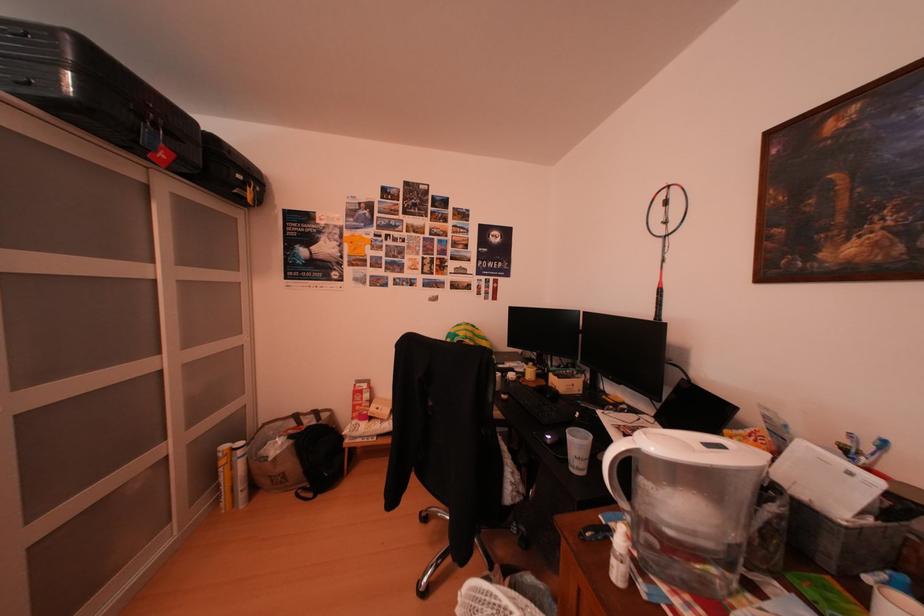
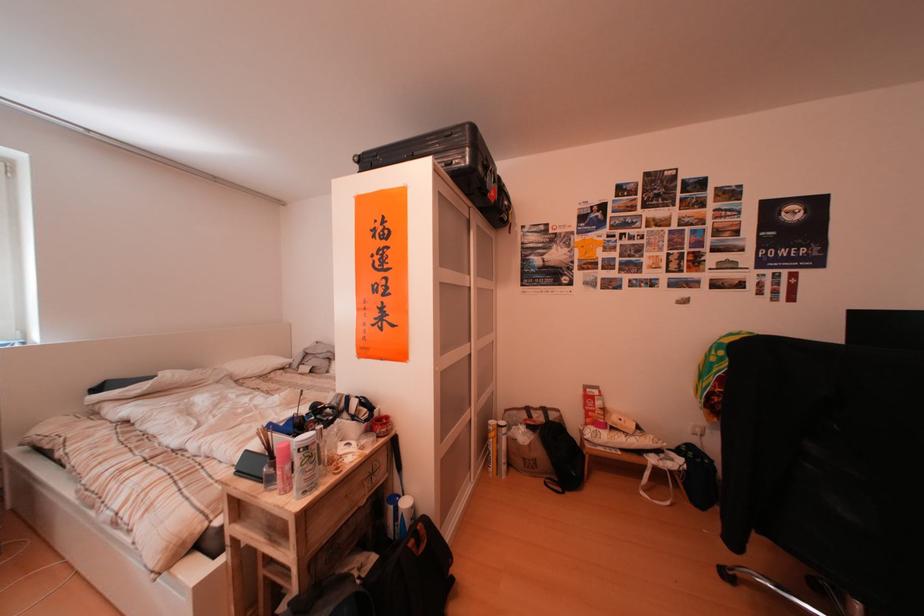
Question: The camera is either moving clockwise (left) or counter-clockwise (right) around the object. The first image is from the beginning of the video and the second image is from the end. Is the camera moving left or right when shooting the video?

Choices:
 (A) Left
 (B) Right

Answer: (B)